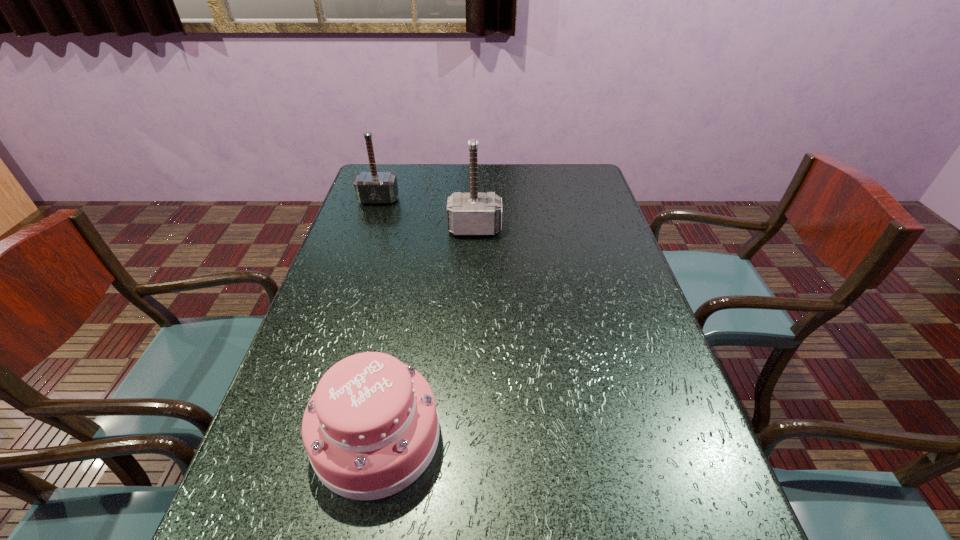
I want to click on hammer located at the left edge, so click(x=373, y=187).

Identify the location of cake that is at the left edge. This screenshot has height=540, width=960. pos(371,428).

Find the location of `object that is at the far left corner`. object that is at the far left corner is located at coordinates (373, 187).

Find the location of a particular element. The image size is (960, 540). free location at the left edge of the desktop is located at coordinates coord(388,218).

Find the location of `free space at the right edge of the desktop`. free space at the right edge of the desktop is located at coordinates (597, 239).

In the image, there is a desktop. At what (x,y) coordinates should I click in order to perform the action: click on vacant space at the far right corner. Please return your answer as a coordinate pair (x, y). Looking at the image, I should click on (554, 164).

At what (x,y) coordinates should I click in order to perform the action: click on free space that is in between the tallest object and the shortest object. Please return your answer as a coordinate pair (x, y). This screenshot has width=960, height=540. Looking at the image, I should click on click(x=426, y=333).

The width and height of the screenshot is (960, 540). In order to click on vacant space in between the second tallest object and the cake in this screenshot , I will do `click(377, 318)`.

Where is `free space between the shortest object and the farther hammer`? The height and width of the screenshot is (540, 960). free space between the shortest object and the farther hammer is located at coordinates (377, 318).

The height and width of the screenshot is (540, 960). What are the coordinates of `free point between the tallest object and the shortest object` in the screenshot? It's located at (426, 333).